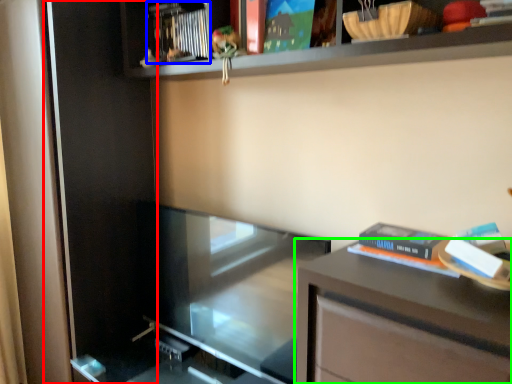
Question: Based on their relative distances, which object is nearer to screen door (highlighted by a red box)? Choose from book (highlighted by a blue box) and table (highlighted by a green box).

Choices:
 (A) book
 (B) table

Answer: (A)